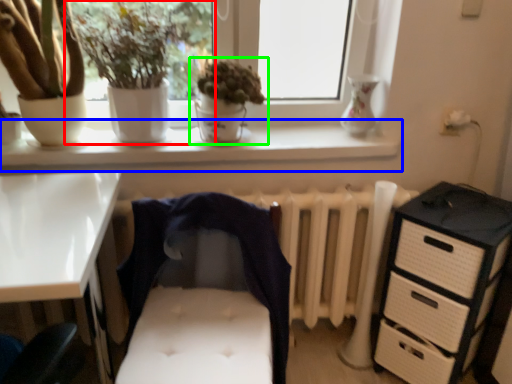
Question: Which is farther away from houseplant (highlighted by a red box)? window sill (highlighted by a blue box) or houseplant (highlighted by a green box)?

Choices:
 (A) window sill
 (B) houseplant

Answer: (A)